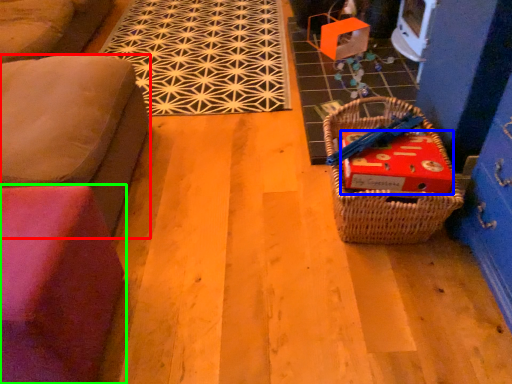
Question: Based on their relative distances, which object is farther from furniture (highlighted by a red box)? Choose from cardboard box (highlighted by a blue box) and furniture (highlighted by a green box).

Choices:
 (A) cardboard box
 (B) furniture

Answer: (A)